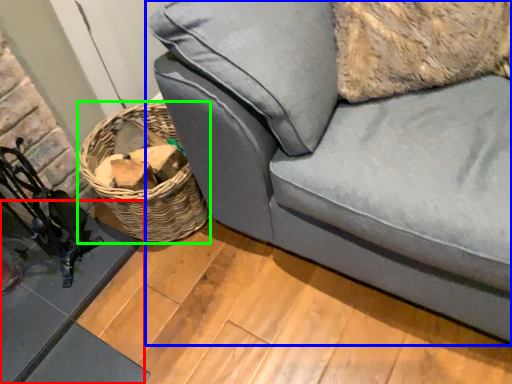
Question: Which is nearer to the table (highlighted by a red box)? studio couch (highlighted by a blue box) or basket (highlighted by a green box).

Choices:
 (A) studio couch
 (B) basket

Answer: (B)